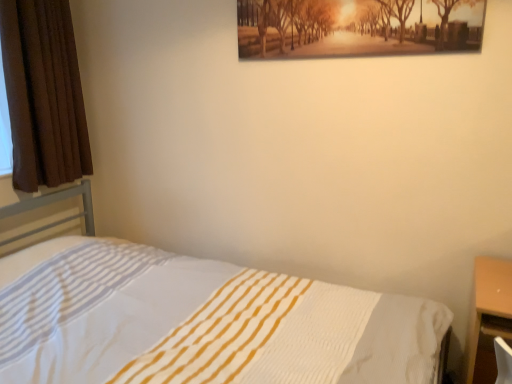
Measure the distance between point [392,351] and camera.

Point [392,351] is 4.85 feet away from camera.

Describe the element at coordinates (357, 27) in the screenshot. I see `matte wooden picture frame at upper center` at that location.

This screenshot has width=512, height=384. What are the coordinates of `white textured bed at center` in the screenshot? It's located at (200, 322).

Looking at this image, what's the angular difference between white textured bed at center and brown velvet curtain at left's facing directions?

white textured bed at center and brown velvet curtain at left are facing 0.672 degrees away from each other.

You are a GUI agent. You are given a task and a screenshot of the screen. Output one action in this format:
    pyautogui.click(x=<x>, y=<y>)
    Task: Click on the curtain to the left of white textured bed at center
    This screenshot has height=384, width=512.
    Given the screenshot: What is the action you would take?
    pyautogui.click(x=42, y=94)

Considering the sizes of objects white textured bed at center and brown velvet curtain at left in the image provided, who is smaller, white textured bed at center or brown velvet curtain at left?

With smaller size is brown velvet curtain at left.

Which is behind, matte wooden picture frame at upper center or white textured bed at center?

matte wooden picture frame at upper center is behind.

Looking at their sizes, would you say matte wooden picture frame at upper center is wider or thinner than white textured bed at center?

Considering their sizes, matte wooden picture frame at upper center looks slimmer than white textured bed at center.

Does matte wooden picture frame at upper center appear on the left side of brown velvet curtain at left?

In fact, matte wooden picture frame at upper center is to the right of brown velvet curtain at left.

From a real-world perspective, is matte wooden picture frame at upper center beneath brown velvet curtain at left?

Incorrect, from a real-world perspective, matte wooden picture frame at upper center is higher than brown velvet curtain at left.

Is matte wooden picture frame at upper center taller than brown velvet curtain at left?

No, matte wooden picture frame at upper center is not taller than brown velvet curtain at left.

From the image's perspective, is brown velvet curtain at left above matte wooden picture frame at upper center?

No.

In the scene shown: Does brown velvet curtain at left turn towards matte wooden picture frame at upper center?

Yes, brown velvet curtain at left is oriented towards matte wooden picture frame at upper center.

Considering the sizes of objects brown velvet curtain at left and matte wooden picture frame at upper center in the image provided, who is smaller, brown velvet curtain at left or matte wooden picture frame at upper center?

With smaller size is matte wooden picture frame at upper center.

Is brown velvet curtain at left to the right of matte wooden picture frame at upper center from the viewer's perspective?

No, brown velvet curtain at left is not to the right of matte wooden picture frame at upper center.

In the scene shown: Are white textured bed at center and matte wooden picture frame at upper center beside each other?

No, white textured bed at center is not in contact with matte wooden picture frame at upper center.

Is white textured bed at center positioned with its back to matte wooden picture frame at upper center?

No, white textured bed at center's orientation is not away from matte wooden picture frame at upper center.

From the image's perspective, is white textured bed at center located above matte wooden picture frame at upper center?

No.

How many degrees apart are the facing directions of white textured bed at center and matte wooden picture frame at upper center?

They differ by 89.1 degrees in their facing directions.

From their relative heights in the image, would you say brown velvet curtain at left is taller or shorter than white textured bed at center?

brown velvet curtain at left is taller than white textured bed at center.

You are a GUI agent. You are given a task and a screenshot of the screen. Output one action in this format:
    pyautogui.click(x=<x>, y=<y>)
    Task: Click on the bed that is in front of the brown velvet curtain at left
    Image resolution: width=512 pixels, height=384 pixels.
    Given the screenshot: What is the action you would take?
    pyautogui.click(x=200, y=322)

Does brown velvet curtain at left have a greater width compared to white textured bed at center?

Incorrect, the width of brown velvet curtain at left does not surpass that of white textured bed at center.

From the image's perspective, is brown velvet curtain at left on top of white textured bed at center?

Yes, from the image's perspective, brown velvet curtain at left is above white textured bed at center.

At what (x,y) coordinates should I click in order to perform the action: click on bed in front of the brown velvet curtain at left. Please return your answer as a coordinate pair (x, y). Image resolution: width=512 pixels, height=384 pixels. Looking at the image, I should click on point(200,322).

Identify the location of picture frame located above the white textured bed at center (from a real-world perspective). (357, 27).

Estimate the real-world distances between objects in this image. Which object is further from white textured bed at center, matte wooden picture frame at upper center or brown velvet curtain at left?

matte wooden picture frame at upper center lies further to white textured bed at center than the other object.

Considering their positions, is brown velvet curtain at left positioned further to matte wooden picture frame at upper center than white textured bed at center?

Based on the image, brown velvet curtain at left appears to be further to matte wooden picture frame at upper center.

Based on their spatial positions, is brown velvet curtain at left or matte wooden picture frame at upper center further from white textured bed at center?

matte wooden picture frame at upper center.

Looking at the image, which one is located further to brown velvet curtain at left, matte wooden picture frame at upper center or white textured bed at center?

matte wooden picture frame at upper center is further to brown velvet curtain at left.

Which object lies further to the anchor point brown velvet curtain at left, white textured bed at center or matte wooden picture frame at upper center?

The object further to brown velvet curtain at left is matte wooden picture frame at upper center.

Considering their positions, is white textured bed at center positioned further to matte wooden picture frame at upper center than brown velvet curtain at left?

brown velvet curtain at left lies further to matte wooden picture frame at upper center than the other object.

Find the location of a particular element. The width and height of the screenshot is (512, 384). bed between brown velvet curtain at left and matte wooden picture frame at upper center from left to right is located at coordinates (200, 322).